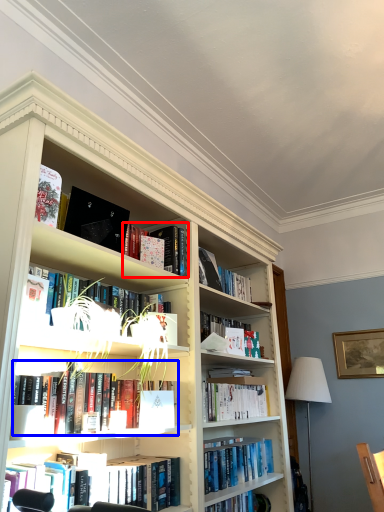
Question: Which object appears closest to the camera in this image, book (highlighted by a red box) or book (highlighted by a blue box)?

Choices:
 (A) book
 (B) book

Answer: (B)